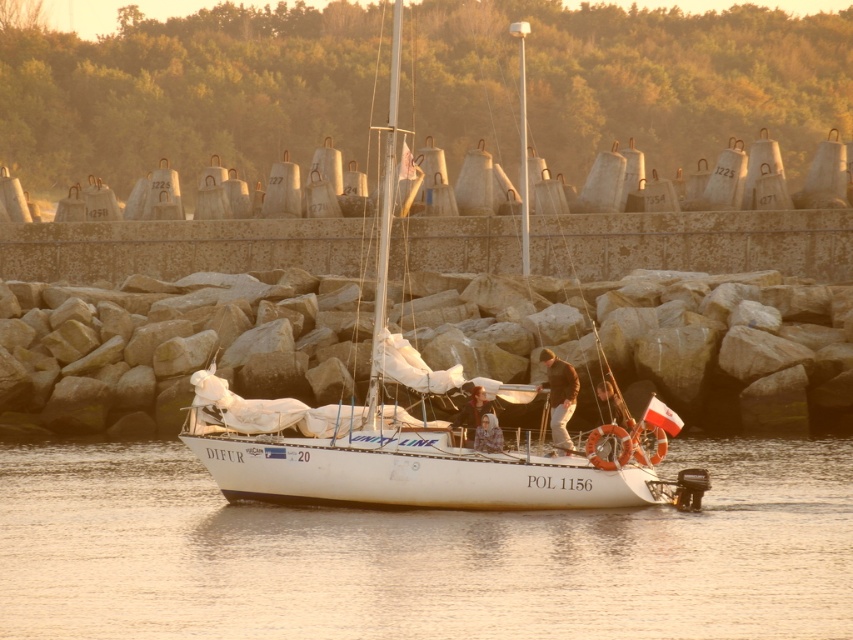
Does white matte sailboat at center have a greater width compared to smooth beige shirt at center?

Yes.

Is white matte sailboat at center smaller than smooth beige shirt at center?

No.

Locate an element on the screen. white matte sailboat at center is located at coordinates (416, 432).

Locate an element on the screen. The image size is (853, 640). white glossy water at center is located at coordinates (421, 554).

Who is positioned more to the right, white glossy water at center or white matte sailboat at center?

white glossy water at center is more to the right.

Locate an element on the screen. white glossy water at center is located at coordinates (421, 554).

Does white glossy water at center have a greater width compared to smooth beige shirt at center?

Yes.

Who is taller, white glossy water at center or smooth beige shirt at center?

white glossy water at center is taller.

Is point (360, 632) in front of point (496, 417)?

Yes.

What are the coordinates of `white glossy water at center` in the screenshot? It's located at (421, 554).